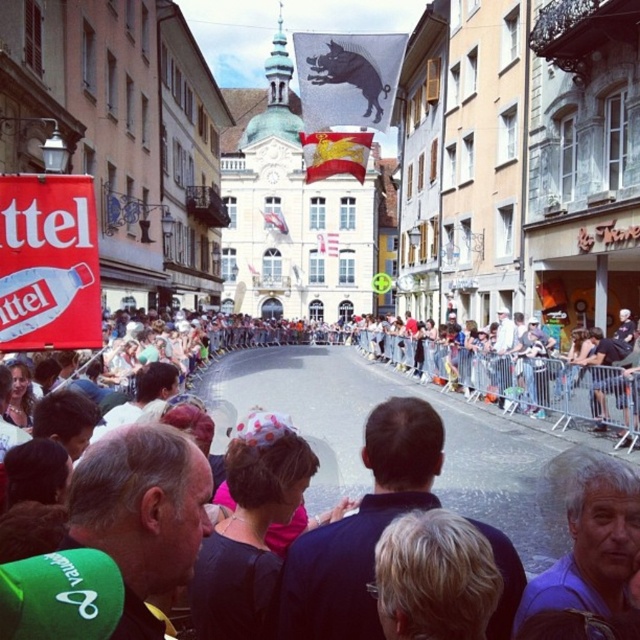
You are a photographer trying to capture the entire scene without any obstructions. You notice the matte black banner at center and the gray hair at center in your viewfinder. Which object should you adjust your camera angle to avoid covering the other?

The matte black banner at center is positioned over gray hair at center, so adjusting the camera angle downward would allow you to capture the gray hair at center without the banner obstructing it.

You are a pedestrian trying to read the white plastic sign at upper left and the matte black banner at center. Which one is positioned to the right side?

The matte black banner at center is to the right of the white plastic sign at upper left.